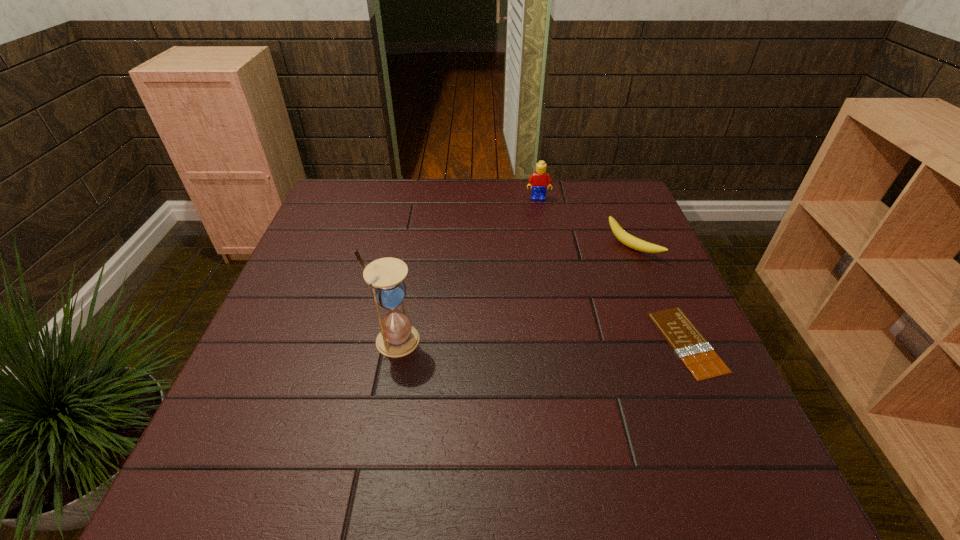
In the image, there is a desktop. Where is `vacant area at the left edge`? vacant area at the left edge is located at coordinates (306, 363).

Find the location of a particular element. This screenshot has width=960, height=540. vacant space at the right edge is located at coordinates (591, 221).

Identify the location of free space at the far left corner of the desktop. The width and height of the screenshot is (960, 540). (371, 194).

In the image, there is a desktop. At what (x,y) coordinates should I click in order to perform the action: click on vacant space at the near left corner. Please return your answer as a coordinate pair (x, y). Looking at the image, I should click on (272, 435).

Locate an element on the screen. Image resolution: width=960 pixels, height=540 pixels. vacant space at the far right corner of the desktop is located at coordinates (606, 220).

Identify the location of free space between the tallest object and the third shortest object. (x=467, y=269).

Image resolution: width=960 pixels, height=540 pixels. Identify the location of free space between the third tallest object and the second object from left to right. (586, 223).

This screenshot has height=540, width=960. In order to click on vacant point located between the third tallest object and the shortest object in this screenshot , I will do [x=660, y=295].

Identify the location of vacant region between the hourglass and the third shortest object. (467, 269).

The image size is (960, 540). Find the location of `free space between the farthest object and the shortest object`. free space between the farthest object and the shortest object is located at coordinates (612, 270).